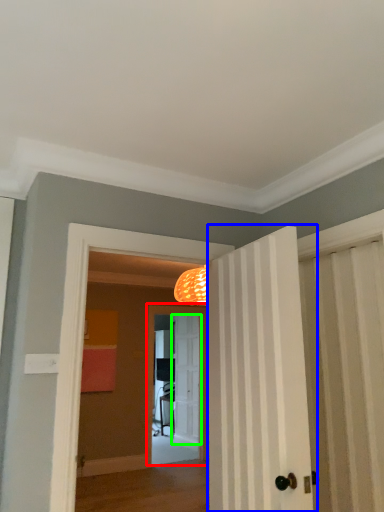
Question: Based on their relative distances, which object is nearer to screen door (highlighted by a red box)? Choose from door (highlighted by a blue box) and door (highlighted by a green box).

Choices:
 (A) door
 (B) door

Answer: (B)